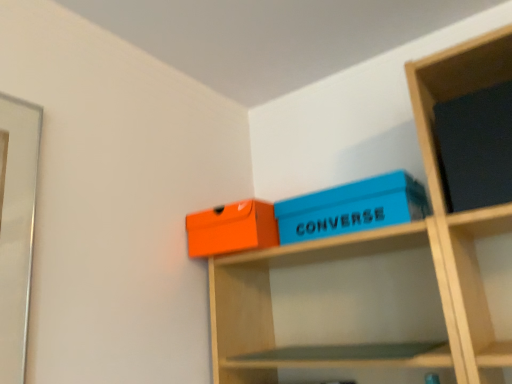
Question: Based on their sizes in the image, would you say blue matte shoebox at upper center, which ranks as the first box in right-to-left order, is bigger or smaller than matte black book at upper right?

Choices:
 (A) big
 (B) small

Answer: (A)

Question: Considering the relative positions of blue matte shoebox at upper center, which is counted as the 2th box, starting from the left, and matte black book at upper right in the image provided, is blue matte shoebox at upper center, which is counted as the 2th box, starting from the left, to the left or to the right of matte black book at upper right?

Choices:
 (A) right
 (B) left

Answer: (B)

Question: Which object is the farthest from the blue matte shoebox at upper center, which ranks as the first box in right-to-left order?

Choices:
 (A) matte black book at upper right
 (B) matte orange box at upper center, arranged as the second box when viewed from the right

Answer: (A)

Question: Which is farther from the matte orange box at upper center, arranged as the second box when viewed from the right?

Choices:
 (A) blue matte shoebox at upper center, which ranks as the first box in right-to-left order
 (B) matte black book at upper right

Answer: (B)